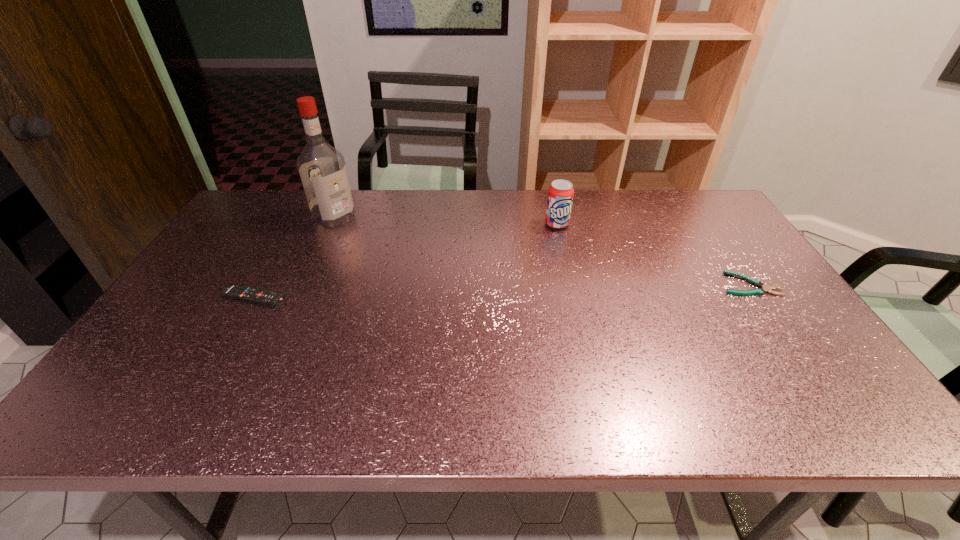
The image size is (960, 540). In the image, there is a desktop. In order to click on free space at the left edge in this screenshot , I will do `click(228, 247)`.

Identify the location of vacant area at the right edge of the desktop. (777, 348).

The width and height of the screenshot is (960, 540). Identify the location of free space at the far left corner. (242, 210).

The height and width of the screenshot is (540, 960). I want to click on free space at the near left corner of the desktop, so click(146, 370).

Where is `vacant space at the far right corner of the desktop`? Image resolution: width=960 pixels, height=540 pixels. vacant space at the far right corner of the desktop is located at coordinates (694, 217).

The height and width of the screenshot is (540, 960). In the image, there is a desktop. Find the location of `free region at the near right corner`. free region at the near right corner is located at coordinates coord(842,378).

What are the coordinates of `vacant space that is in between the tallest object and the third shortest object` in the screenshot? It's located at (445, 221).

The image size is (960, 540). What are the coordinates of `empty space between the liquor and the pliers` in the screenshot? It's located at (542, 251).

Locate an element on the screen. This screenshot has height=540, width=960. free point between the third tallest object and the tallest object is located at coordinates (295, 258).

Identify the location of unoccupied area between the remote control and the second tallest object. This screenshot has width=960, height=540. (406, 261).